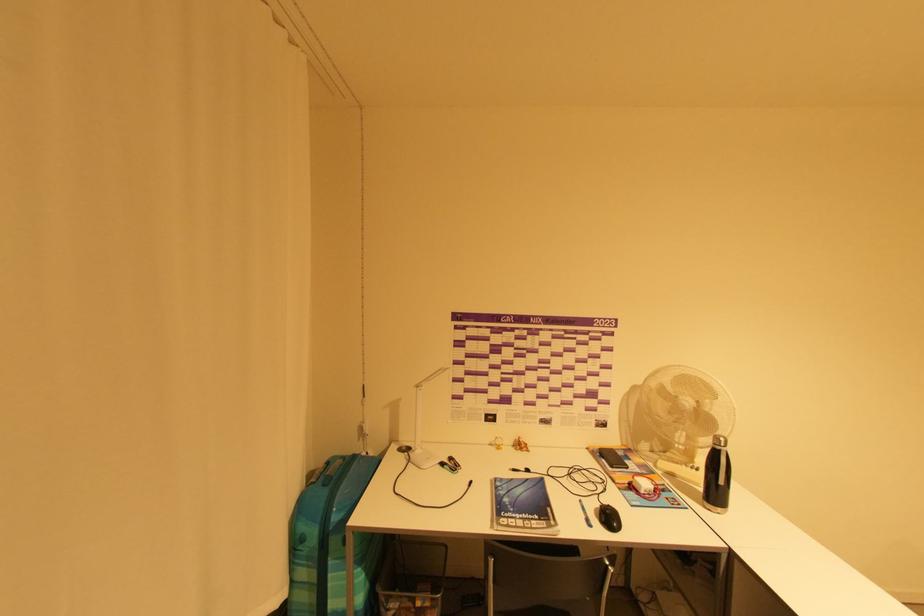
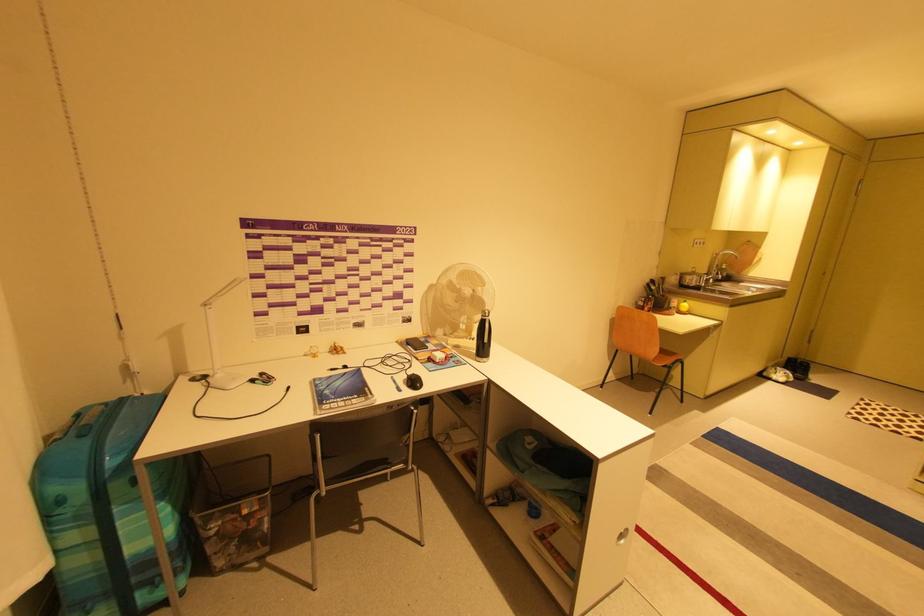
Locate, in the second image, the point that corresponds to (702,469) in the first image.

(479, 339)